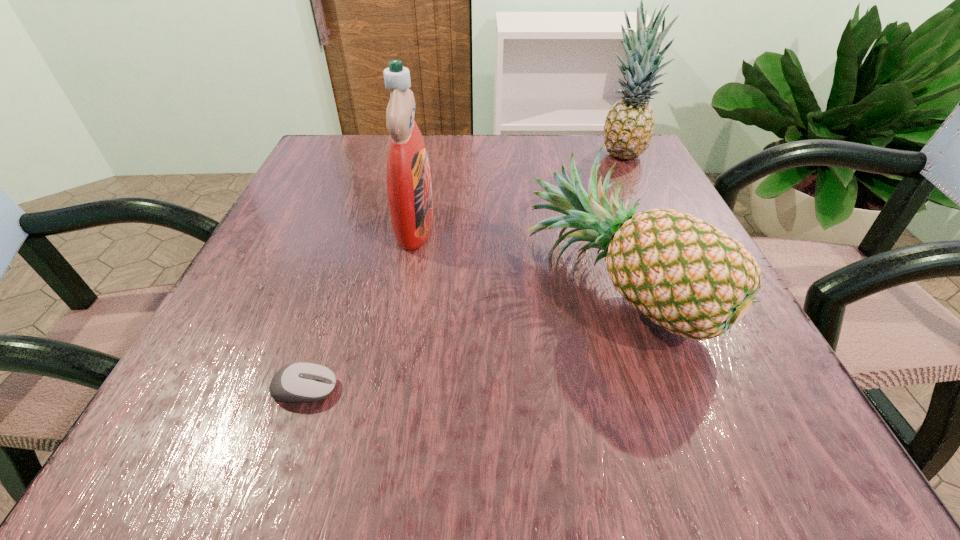
You are a GUI agent. You are given a task and a screenshot of the screen. Output one action in this format:
    pyautogui.click(x=<x>, y=<y>)
    Task: Click on the vacant space at the far right corner of the desktop
    
    Given the screenshot: What is the action you would take?
    pyautogui.click(x=643, y=188)

At what (x,y) coordinates should I click in order to perform the action: click on free space at the near right corner of the desktop. Please return your answer as a coordinate pair (x, y). Looking at the image, I should click on 810,450.

I want to click on vacant space that's between the farther pineapple and the second object from left to right, so click(517, 190).

Image resolution: width=960 pixels, height=540 pixels. Find the location of `unoccupied position between the detergent and the farthest object`. unoccupied position between the detergent and the farthest object is located at coordinates (517, 190).

You are a GUI agent. You are given a task and a screenshot of the screen. Output one action in this format:
    pyautogui.click(x=<x>, y=<y>)
    Task: Click on the free spot between the shortest object and the third object from right to left
    The height and width of the screenshot is (540, 960).
    Given the screenshot: What is the action you would take?
    pyautogui.click(x=360, y=307)

This screenshot has width=960, height=540. I want to click on blank region between the detergent and the taller pineapple, so click(517, 190).

Find the location of `empty space between the farthest object and the leftmost object`. empty space between the farthest object and the leftmost object is located at coordinates (463, 272).

I want to click on unoccupied area between the detergent and the taller pineapple, so click(x=517, y=190).

At what (x,y) coordinates should I click in order to perform the action: click on vacant region between the farther pineapple and the leftmost object. Please return your answer as a coordinate pair (x, y). Looking at the image, I should click on (463, 272).

Image resolution: width=960 pixels, height=540 pixels. In order to click on free space between the farther pineapple and the detergent in this screenshot , I will do (x=517, y=190).